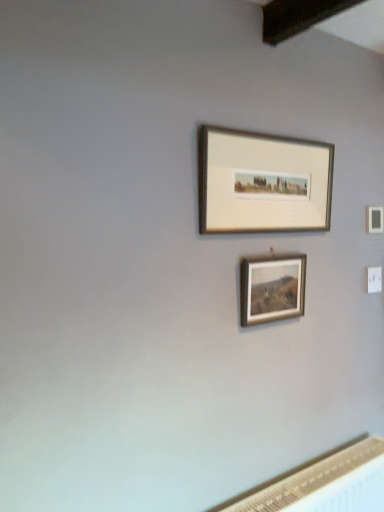
Question: Is wooden frame at center, the 2th picture frame positioned from the top, facing away from white textured radiator at lower right?

Choices:
 (A) no
 (B) yes

Answer: (A)

Question: Can you confirm if wooden frame at center, the 1th picture frame from the bottom, is smaller than white textured radiator at lower right?

Choices:
 (A) no
 (B) yes

Answer: (B)

Question: Can we say wooden frame at center, the 2th picture frame positioned from the top, lies outside white textured radiator at lower right?

Choices:
 (A) no
 (B) yes

Answer: (B)

Question: Does wooden frame at center, the 1th picture frame from the bottom, appear on the right side of white textured radiator at lower right?

Choices:
 (A) yes
 (B) no

Answer: (B)

Question: From the image's perspective, is wooden frame at center, the 1th picture frame from the bottom, below white textured radiator at lower right?

Choices:
 (A) yes
 (B) no

Answer: (B)

Question: Are wooden frame at center, the 2th picture frame positioned from the top, and white textured radiator at lower right making contact?

Choices:
 (A) yes
 (B) no

Answer: (B)

Question: Could you tell me if silver metallic picture frame at upper center, which ranks as the second picture frame in bottom-to-top order, is turned towards white textured radiator at lower right?

Choices:
 (A) no
 (B) yes

Answer: (A)

Question: Can you confirm if silver metallic picture frame at upper center, which ranks as the second picture frame in bottom-to-top order, is thinner than white textured radiator at lower right?

Choices:
 (A) yes
 (B) no

Answer: (A)

Question: Can you confirm if silver metallic picture frame at upper center, the first picture frame from the top, is wider than white textured radiator at lower right?

Choices:
 (A) no
 (B) yes

Answer: (A)

Question: Does silver metallic picture frame at upper center, which ranks as the second picture frame in bottom-to-top order, appear on the left side of white textured radiator at lower right?

Choices:
 (A) no
 (B) yes

Answer: (B)

Question: Can you confirm if silver metallic picture frame at upper center, the first picture frame from the top, is positioned to the right of white textured radiator at lower right?

Choices:
 (A) no
 (B) yes

Answer: (A)

Question: Is silver metallic picture frame at upper center, which ranks as the second picture frame in bottom-to-top order, turned away from white textured radiator at lower right?

Choices:
 (A) yes
 (B) no

Answer: (B)

Question: Can you confirm if wooden frame at center, the 1th picture frame from the bottom, is shorter than silver metallic picture frame at upper center, the first picture frame from the top?

Choices:
 (A) no
 (B) yes

Answer: (B)